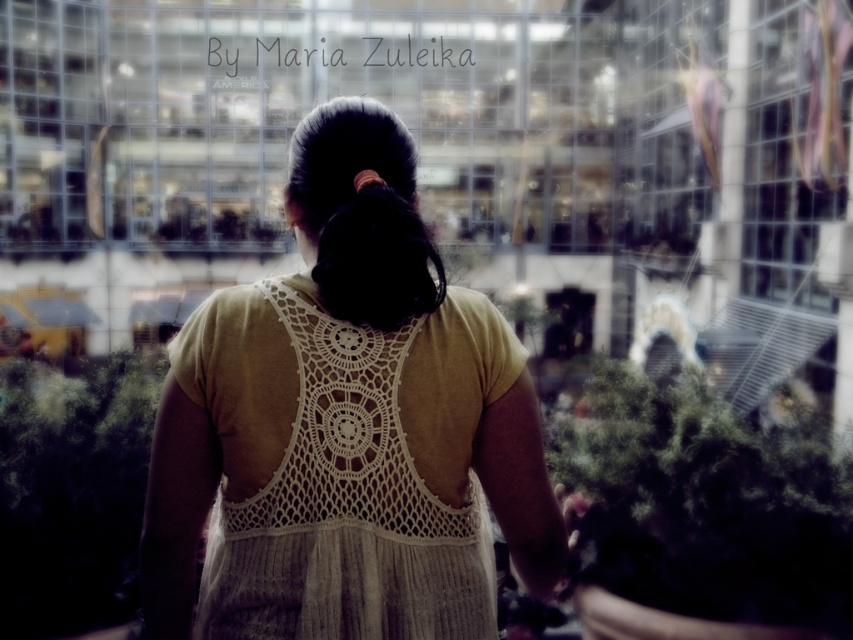
Question: In this image, where is green fuzzy plant at lower right located relative to green leafy plant at lower left?

Choices:
 (A) right
 (B) left

Answer: (A)

Question: Among these points, which one is farthest from the camera?

Choices:
 (A) (686, 486)
 (B) (352, 304)
 (C) (357, 432)

Answer: (A)

Question: Does green leafy plant at lower left appear on the right side of black silky hair at center?

Choices:
 (A) no
 (B) yes

Answer: (A)

Question: Which object appears farthest from the camera in this image?

Choices:
 (A) white crochet dress at center
 (B) green fuzzy plant at lower right
 (C) black silky hair at center
 (D) green leafy plant at lower left

Answer: (B)

Question: Which object appears farthest from the camera in this image?

Choices:
 (A) green leafy plant at lower left
 (B) white crochet dress at center

Answer: (A)

Question: Can you confirm if white crochet dress at center is thinner than green leafy plant at lower left?

Choices:
 (A) yes
 (B) no

Answer: (A)